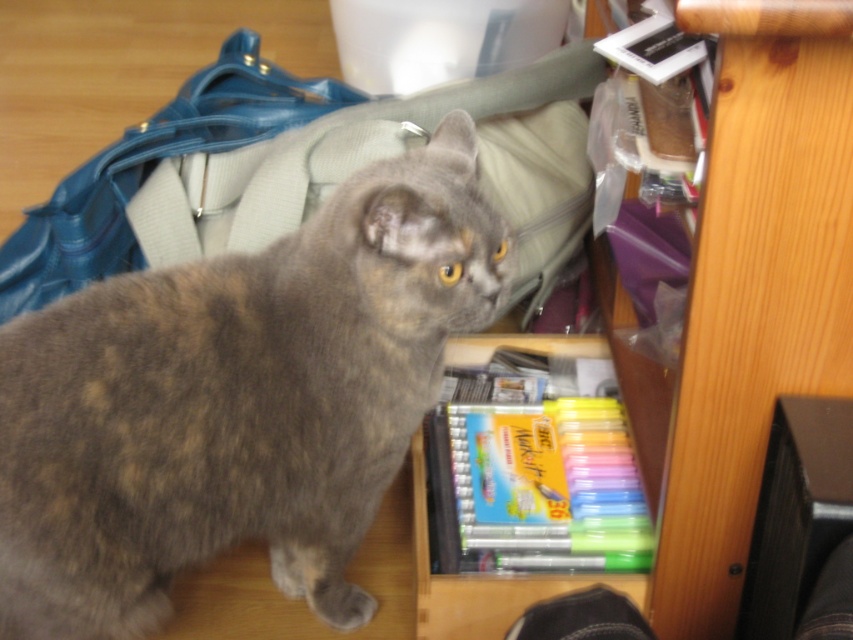
Does gray fur cat at center appear on the right side of black plastic speaker at lower right?

No, gray fur cat at center is not to the right of black plastic speaker at lower right.

Does gray fur cat at center appear over black plastic speaker at lower right?

Yes, gray fur cat at center is above black plastic speaker at lower right.

Is point (33, 616) positioned behind point (846, 422)?

Yes, point (33, 616) is farther from viewer.

In order to click on gray fur cat at center in this screenshot , I will do `click(238, 401)`.

Can you confirm if wooden bookshelf at center is smaller than black plastic speaker at lower right?

No.

Is wooden bookshelf at center thinner than black plastic speaker at lower right?

No, wooden bookshelf at center is not thinner than black plastic speaker at lower right.

Which is behind, point (741, 92) or point (767, 449)?

Positioned behind is point (767, 449).

Locate an element on the screen. The image size is (853, 640). wooden bookshelf at center is located at coordinates (750, 292).

Is point (637, 432) positioned after point (340, 109)?

No, (637, 432) is in front of (340, 109).

This screenshot has height=640, width=853. What do you see at coordinates (750, 292) in the screenshot? I see `wooden bookshelf at center` at bounding box center [750, 292].

Is point (669, 627) more distant than point (50, 269)?

No.

You are a GUI agent. You are given a task and a screenshot of the screen. Output one action in this format:
    pyautogui.click(x=<x>, y=<y>)
    Task: Click on the wooden bookshelf at center
    
    Given the screenshot: What is the action you would take?
    pyautogui.click(x=750, y=292)